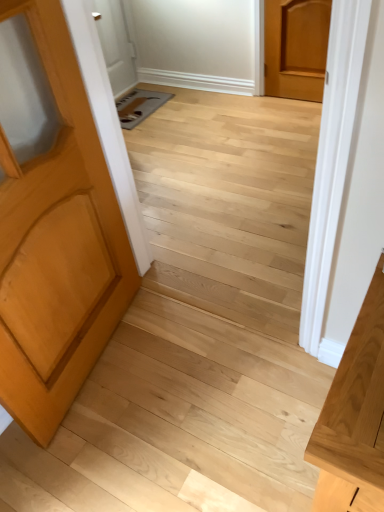
Question: Could light brown wood door at left, arranged as the 2th door when viewed from the right, be considered to be inside light brown wood door at upper right, acting as the first door starting from the back?

Choices:
 (A) yes
 (B) no

Answer: (B)

Question: From the image's perspective, is light brown wood door at upper right, the second door when ordered from front to back, located beneath light brown wood door at left, marked as the first door in a bottom-to-top arrangement?

Choices:
 (A) yes
 (B) no

Answer: (B)

Question: Is light brown wood door at left, the 1th door positioned from the left, at the back of light brown wood door at upper right, the second door when ordered from left to right?

Choices:
 (A) yes
 (B) no

Answer: (B)

Question: Would you say light brown wood door at upper right, the second door when ordered from left to right, is outside light brown wood door at left, positioned as the second door in back-to-front order?

Choices:
 (A) no
 (B) yes

Answer: (B)

Question: Considering the relative sizes of light brown wood door at upper right, arranged as the first door when viewed from the right, and light brown wood door at left, marked as the first door in a bottom-to-top arrangement, in the image provided, is light brown wood door at upper right, arranged as the first door when viewed from the right, taller than light brown wood door at left, marked as the first door in a bottom-to-top arrangement,?

Choices:
 (A) no
 (B) yes

Answer: (A)

Question: Considering the relative sizes of light brown wood door at upper right, the second door when ordered from left to right, and light brown wood door at left, positioned as the second door in back-to-front order, in the image provided, is light brown wood door at upper right, the second door when ordered from left to right, thinner than light brown wood door at left, positioned as the second door in back-to-front order,?

Choices:
 (A) no
 (B) yes

Answer: (B)

Question: Is light wood vanity at right in front of light brown wood door at upper right, marked as the second door in a bottom-to-top arrangement?

Choices:
 (A) no
 (B) yes

Answer: (B)

Question: Can you confirm if light wood vanity at right is thinner than light brown wood door at upper right, arranged as the first door when viewed from the right?

Choices:
 (A) yes
 (B) no

Answer: (B)

Question: From the image's perspective, is light wood vanity at right under light brown wood door at upper right, arranged as the first door when viewed from the top?

Choices:
 (A) yes
 (B) no

Answer: (A)

Question: Is light wood vanity at right not within light brown wood door at upper right, the second door when ordered from left to right?

Choices:
 (A) no
 (B) yes

Answer: (B)

Question: Is light wood vanity at right positioned with its back to light brown wood door at upper right, arranged as the first door when viewed from the top?

Choices:
 (A) no
 (B) yes

Answer: (A)

Question: Is light wood vanity at right to the left of light brown wood door at upper right, arranged as the first door when viewed from the right, from the viewer's perspective?

Choices:
 (A) no
 (B) yes

Answer: (B)

Question: Can you confirm if light brown wood door at left, arranged as the 2th door when viewed from the right, is thinner than light wood vanity at right?

Choices:
 (A) yes
 (B) no

Answer: (A)